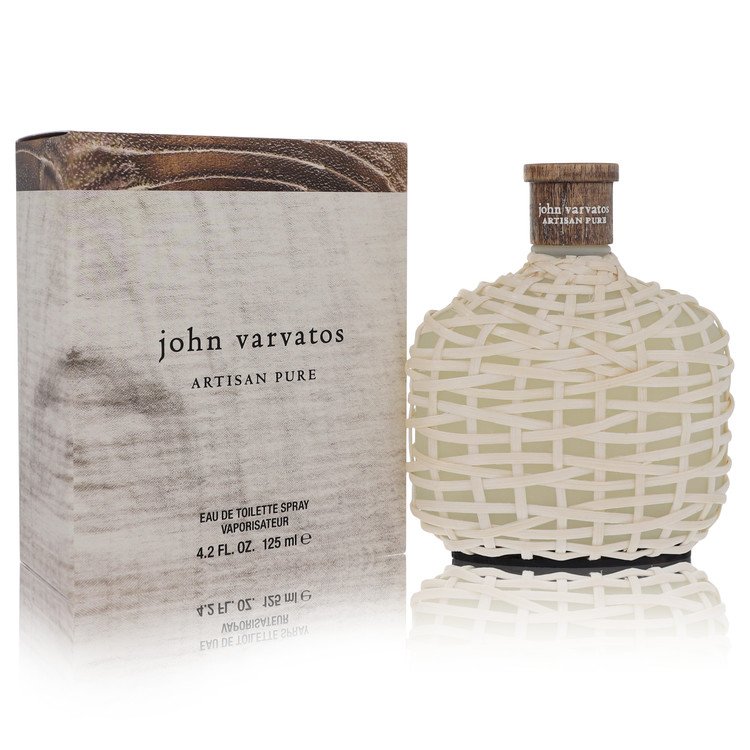
Image resolution: width=750 pixels, height=750 pixels. What are the coordinates of `perfume bottle` in the screenshot? It's located at (562, 385).